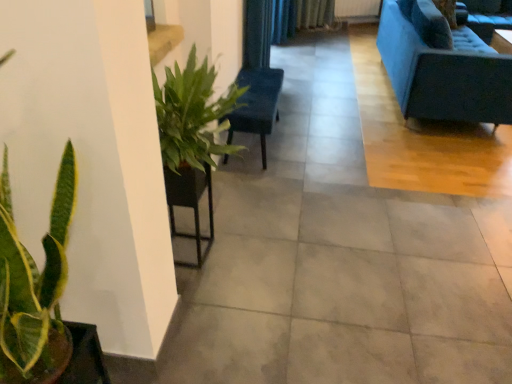
Question: From a real-world perspective, is velvet blue couch at upper right above or below matte brown flowerpot at lower left?

Choices:
 (A) below
 (B) above

Answer: (A)

Question: Is velvet blue couch at upper right spatially inside matte brown flowerpot at lower left, or outside of it?

Choices:
 (A) outside
 (B) inside

Answer: (A)

Question: Which is nearer to the velvet blue couch at upper right?

Choices:
 (A) matte brown flowerpot at lower left
 (B) green glossy plant at lower left
 (C) velvet dark blue armchair at center
 (D) black fabric curtain at upper center

Answer: (C)

Question: Estimate the real-world distances between objects in this image. Which object is farther from the black fabric curtain at upper center?

Choices:
 (A) green glossy plant at lower left
 (B) velvet dark blue armchair at center
 (C) velvet blue couch at upper right
 (D) matte brown flowerpot at lower left

Answer: (A)